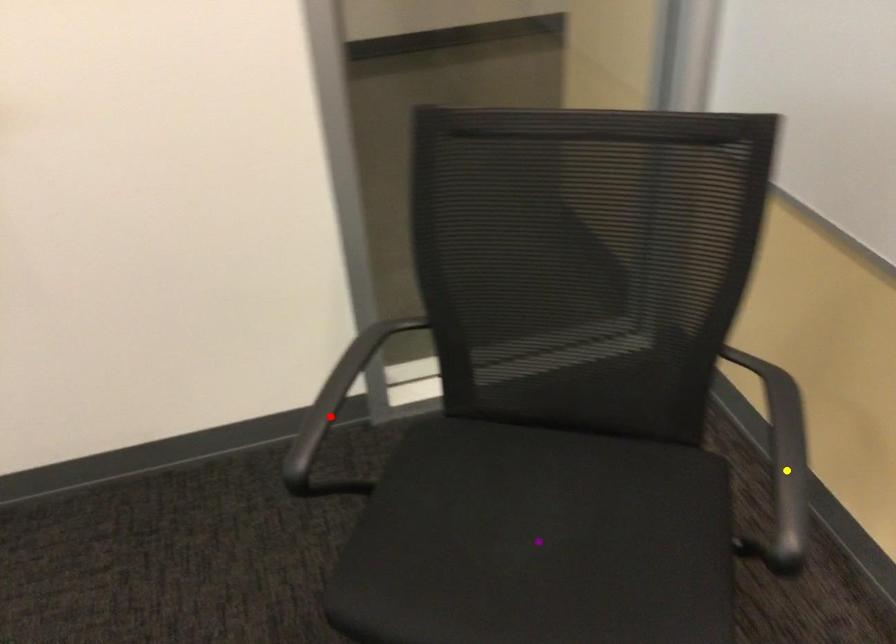
Order these from nearest to farthest:
A) purple point
B) red point
C) yellow point

yellow point, purple point, red point